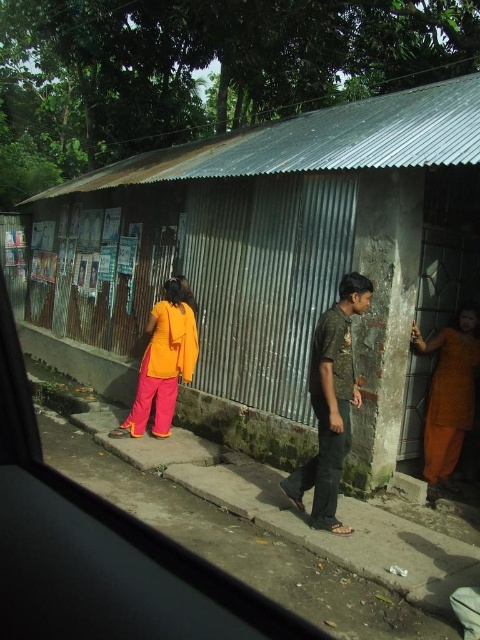
Can you confirm if camouflage-patterned shirt at center is bigger than orange fabric dress at right?

Correct, camouflage-patterned shirt at center is larger in size than orange fabric dress at right.

Between camouflage-patterned shirt at center and orange fabric dress at right, which one appears on the left side from the viewer's perspective?

camouflage-patterned shirt at center

The width and height of the screenshot is (480, 640). I want to click on camouflage-patterned shirt at center, so click(x=331, y=404).

What are the coordinates of `camouflage-patterned shirt at center` in the screenshot? It's located at (331, 404).

Measure the distance between corrugated metal hut at center and camouflage-patterned shirt at center.

The distance of corrugated metal hut at center from camouflage-patterned shirt at center is 3.13 meters.

Who is more distant from viewer, [382,250] or [322,509]?

The point [382,250] is behind.

Who is more forward, (156, 186) or (312, 458)?

Point (312, 458)

This screenshot has width=480, height=640. Identify the location of corrugated metal hut at center. (280, 257).

Which is behind, point (464, 365) or point (133, 403)?

Positioned behind is point (133, 403).

Is point (448, 346) less distant than point (165, 294)?

Yes, it is.

You are a GUI agent. You are given a task and a screenshot of the screen. Output one action in this format:
    pyautogui.click(x=<x>, y=<y>)
    Task: Click on the orange fabric dress at right
    
    Given the screenshot: What is the action you would take?
    pyautogui.click(x=448, y=394)